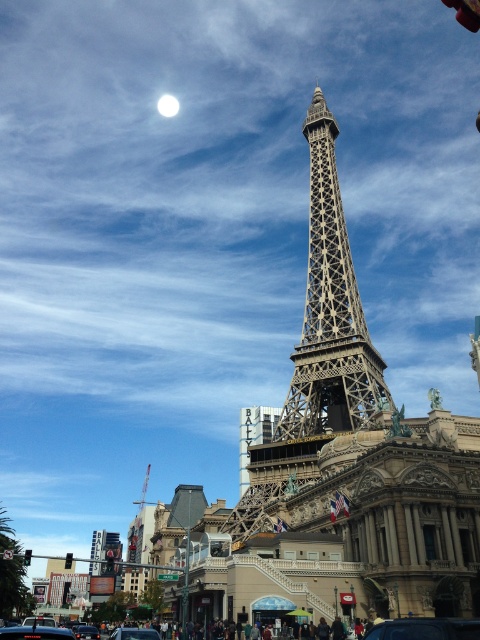
You are a tourist standing in front of the Paris Las Vegas hotel and casino. You see a metallic silver car at center and a white glossy moon at upper center. Which object is positioned to the right of the other?

The metallic silver car at center is to the right of the white glossy moon at upper center.

From the picture: You are standing in front of the Paris Las Vegas hotel and casino, looking at the Eiffel Tower replica. There are two points marked on the tower structure. The first point is at coordinates point [317,292] and the second point is at point [142,637]. Which of these two points is closer to you?

Point [142,637] is closer to you because it is less further to the camera than point [317,292].

You are a photographer planning to take a wide shot of the metallic structure at center and the metallic silver car at center. Based on their sizes, which one should you focus on to ensure it dominates the frame?

The metallic structure at center should be focused on to dominate the frame since its width is larger than the metallic silver car at center.